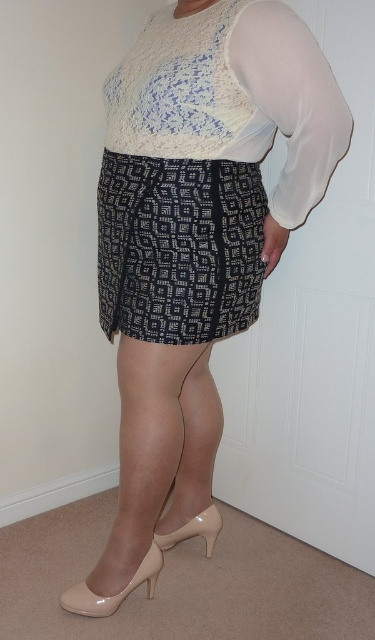
You are a fashion stylist helping a client choose between two pairs of shoes. The client wants to know which shoe is positioned higher on their body. The options are the nude patent leather high heels at lower center and the matte beige pump at lower center. Which one should you recommend?

The nude patent leather high heels at lower center is located above the matte beige pump at lower center, so the nude patent leather high heels at lower center is positioned higher on the body.

You are a fashion designer trying to decide which shoes to pair with a formal outfit. You have two options in front of you, the nude patent leather high heels at lower center and the matte beige pump at lower center. Based on their sizes, which one would you choose if you want the shoes to stand out more visually?

The nude patent leather high heels at lower center has a larger size compared to the matte beige pump at lower center, so choosing the nude patent leather high heels at lower center would make the shoes stand out more visually due to their larger size.

You are a fashion stylist arranging shoes for a client. You have two pairs in front of you, the nude patent leather high heels at lower center and the matte beige pump at lower center. The client wants to place them side by side but prefers the shinier shoe to be on the right. Which shoe should you place on the right?

The nude patent leather high heels at lower center should be placed on the right because they are shinier than the matte beige pump at lower center.